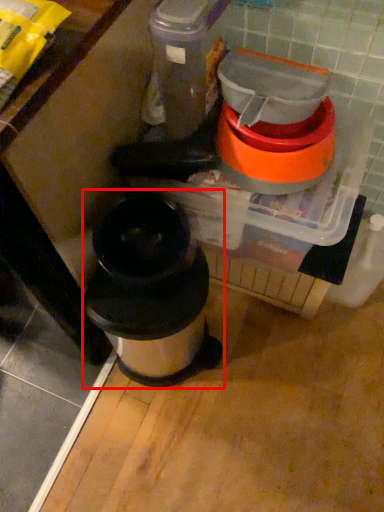
Question: From the image, what is the correct spatial relationship of waste container (annotated by the red box) in relation to appliance?

Choices:
 (A) left
 (B) right

Answer: (A)